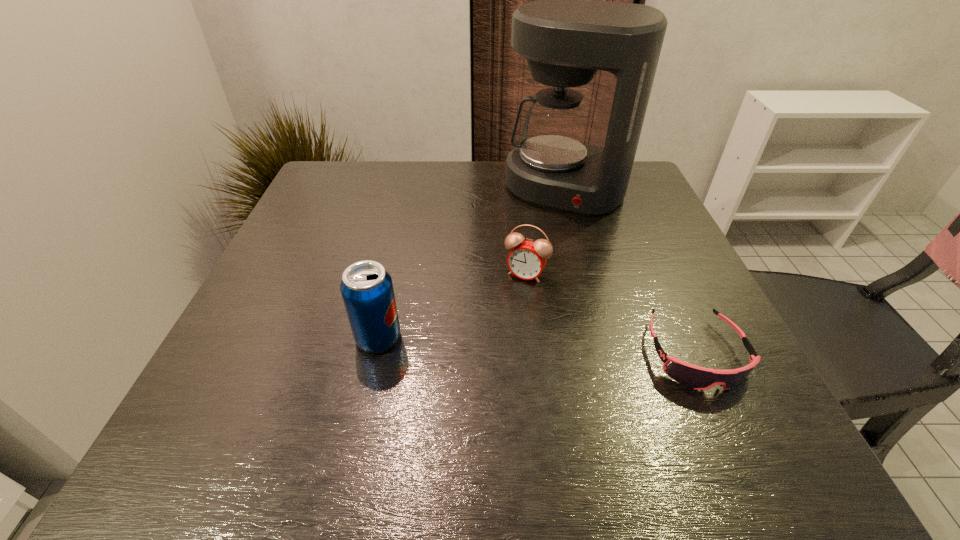
At what (x,y) coordinates should I click in order to perform the action: click on free space on the desktop that is between the third shortest object and the shortest object and is positioned on the front-facing side of the coffee maker. Please return your answer as a coordinate pair (x, y). This screenshot has width=960, height=540. Looking at the image, I should click on (490, 343).

Identify the location of free space on the desktop that is between the leftmost object and the shortest object and is positioned on the clock face of the third tallest object. (488, 343).